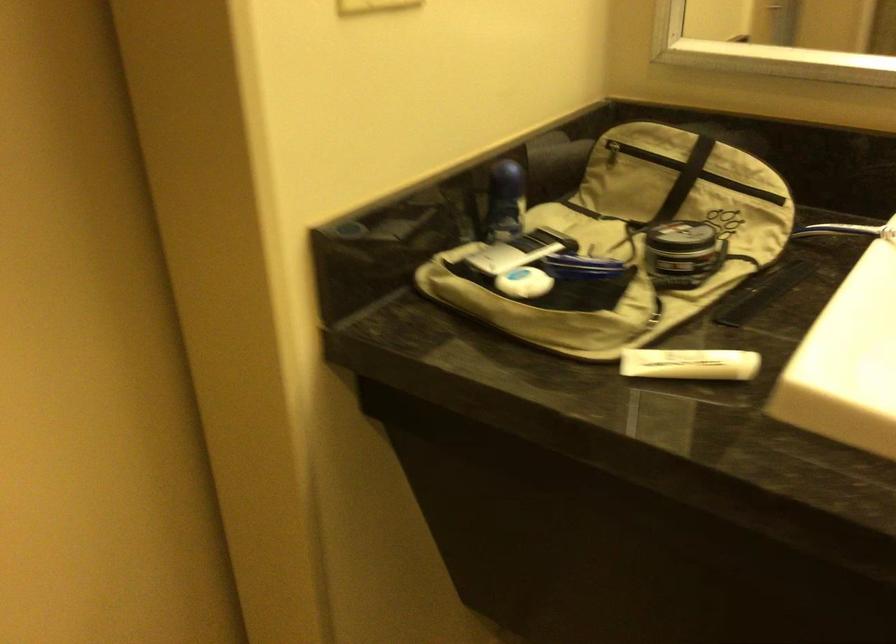
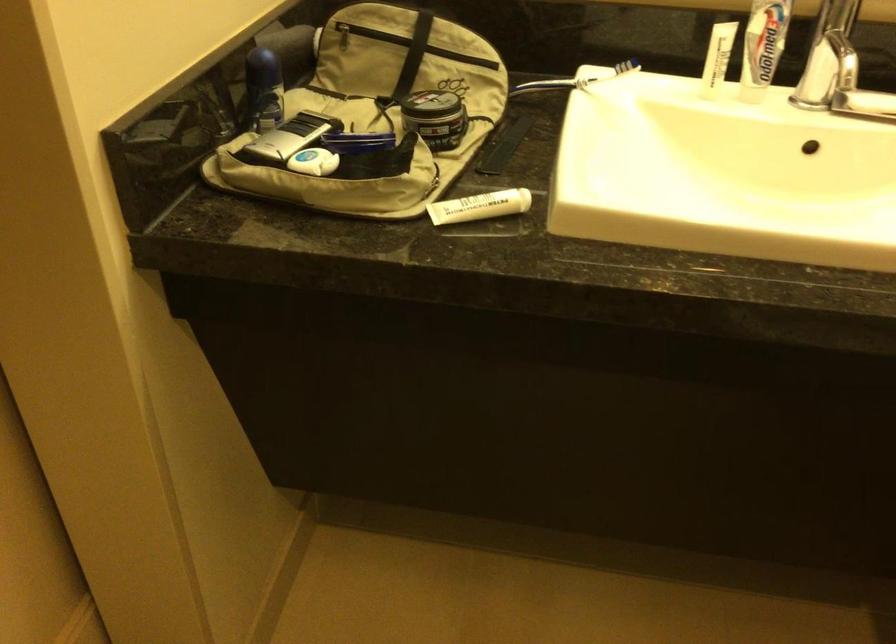
Where in the second image is the point corresponding to point (614, 149) from the first image?

(341, 33)